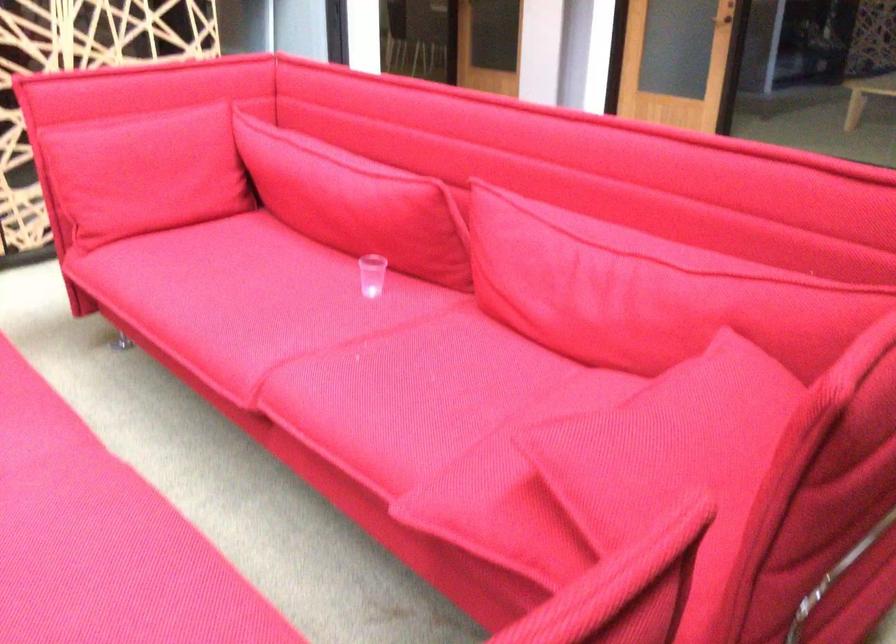
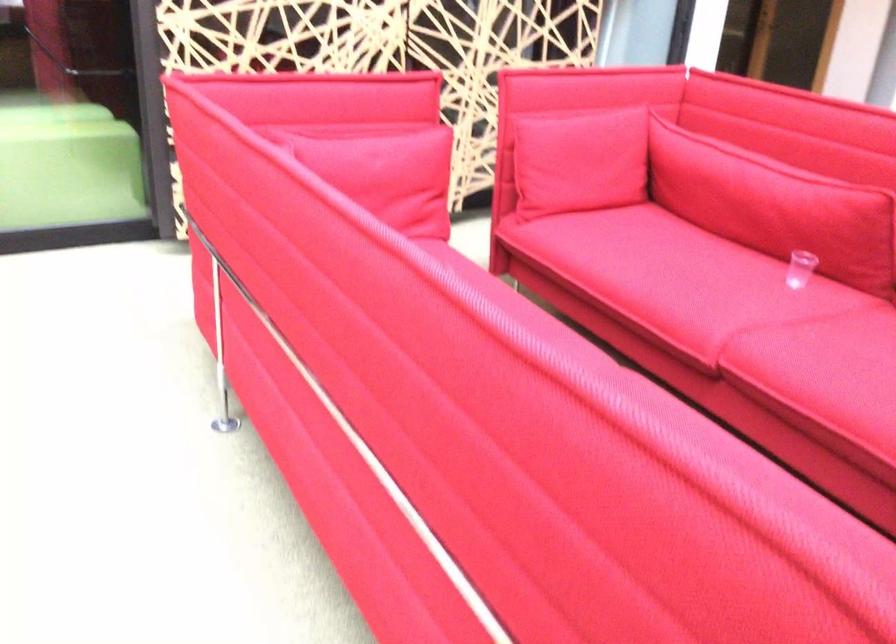
Question: How did the camera likely rotate?

Choices:
 (A) Left
 (B) Right
 (C) Up
 (D) Down

Answer: (A)